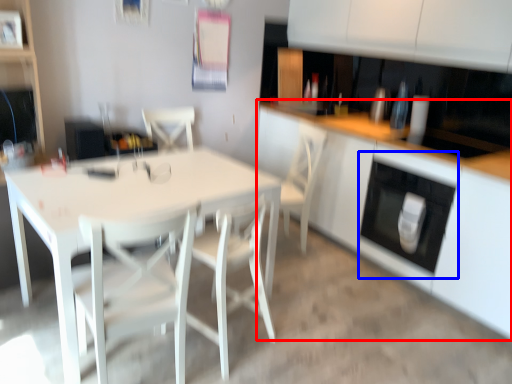
Question: Among these objects, which one is nearest to the camera, cabinetry (highlighted by a red box) or oven (highlighted by a blue box)?

Choices:
 (A) cabinetry
 (B) oven

Answer: (A)